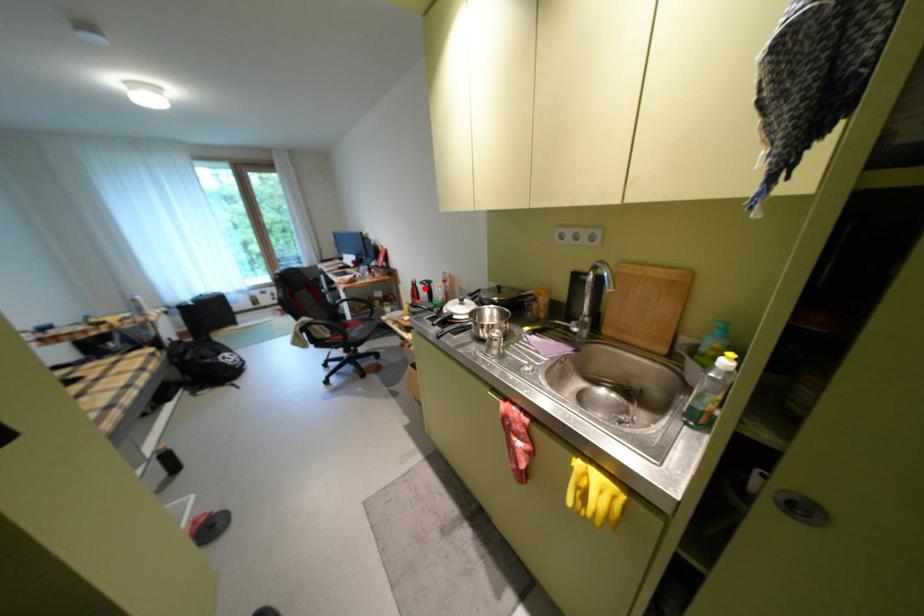
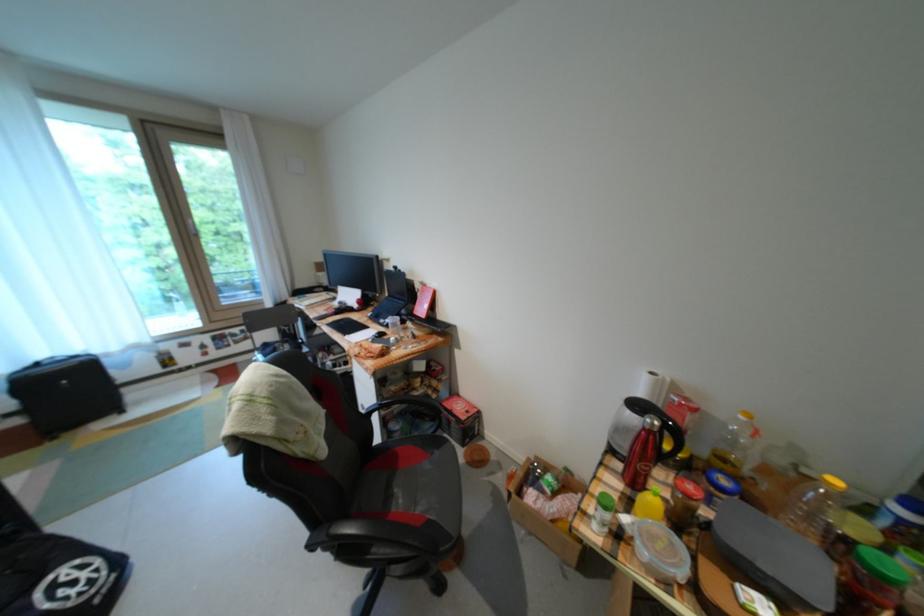
Find the pixel in the second image that matches the highlighted location in the first image.

(662, 438)